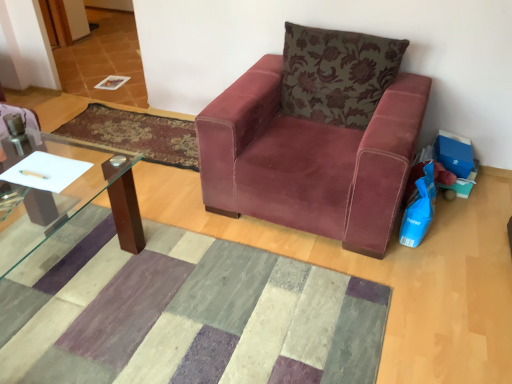
The height and width of the screenshot is (384, 512). In order to click on free space above velvet-like burgundy mat at center, which is counted as the 1th mat, starting from the top (from a real-world perspective) in this screenshot , I will do `click(133, 128)`.